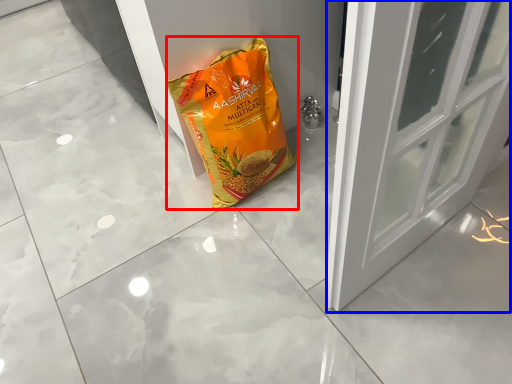
Question: Which point is further to the camera, plastic bag (highlighted by a red box) or door (highlighted by a blue box)?

Choices:
 (A) plastic bag
 (B) door

Answer: (B)